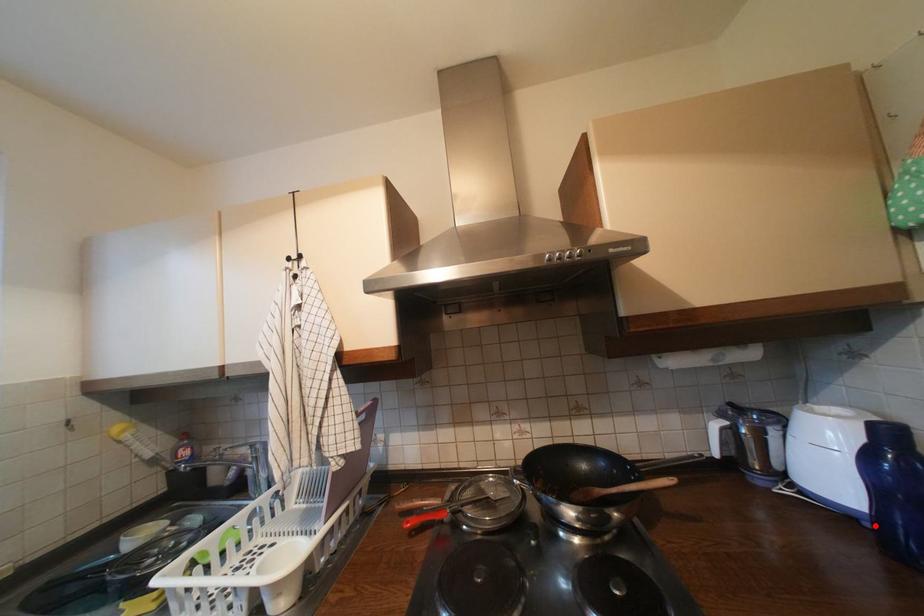
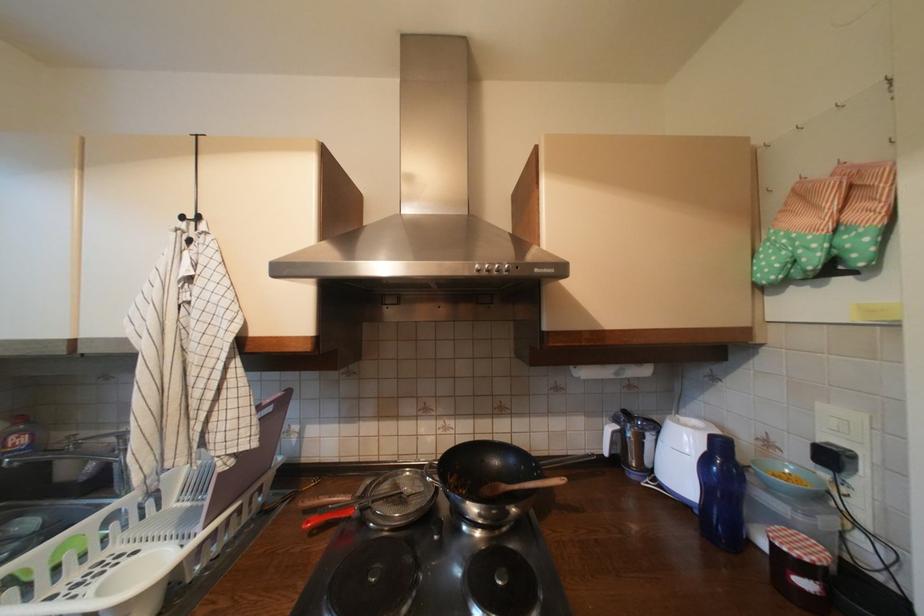
Where in the second image is the point corresponding to the highlighted location from the first image?

(704, 513)